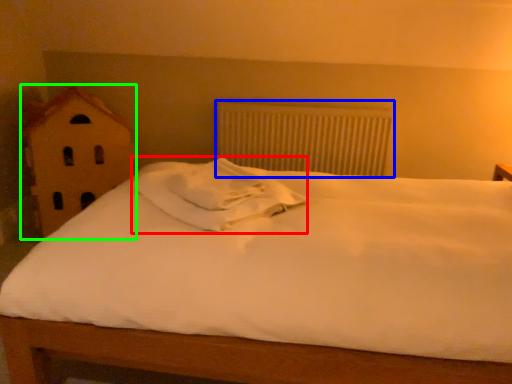
Question: Which object is positioned closest to pillow (highlighted by a red box)? Select from radiator (highlighted by a blue box) and toy (highlighted by a green box).

Choices:
 (A) radiator
 (B) toy

Answer: (B)